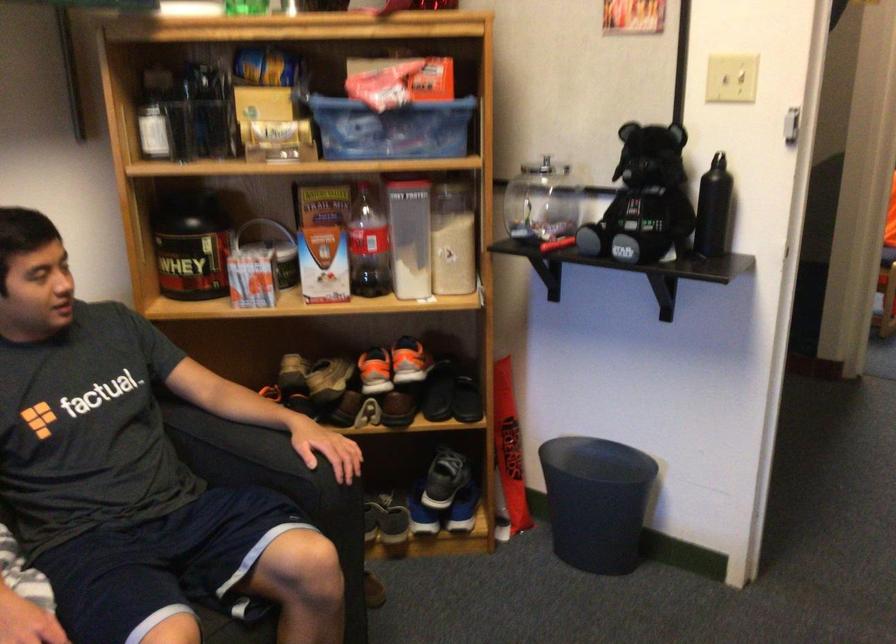
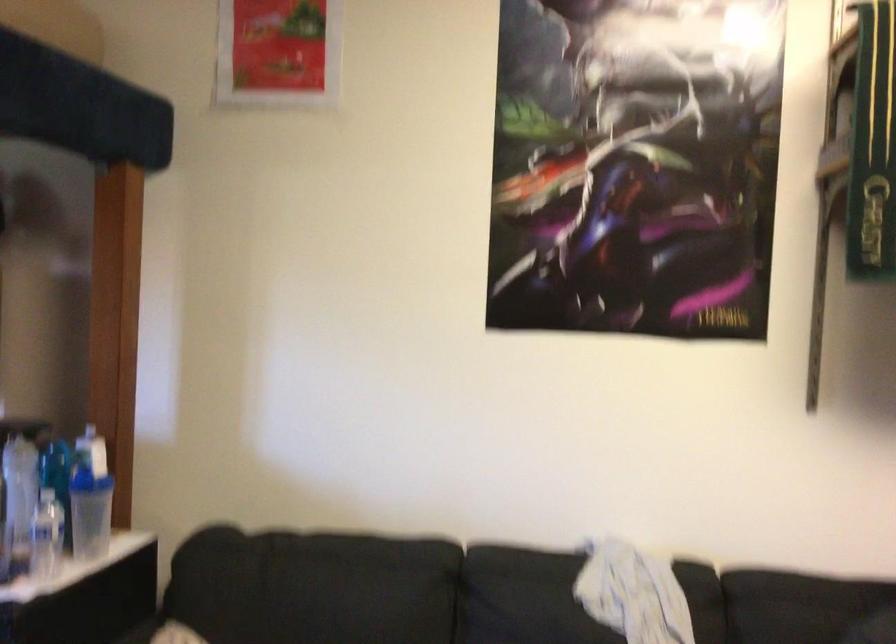
Question: Based on the continuous images, in which direction is the camera rotating? Reply with the corresponding letter.

Choices:
 (A) Left
 (B) Right
 (C) Up
 (D) Down

Answer: (A)